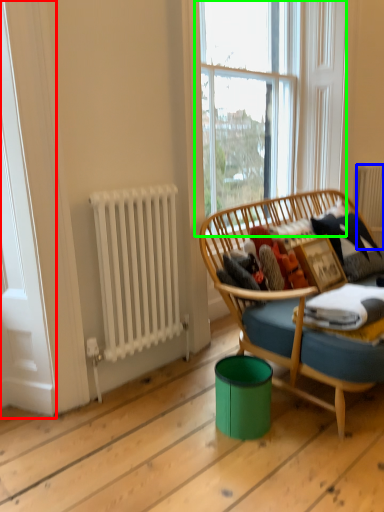
Question: Estimate the real-world distances between objects in this image. Which object is closer to screen door (highlighted by a red box), radiator (highlighted by a blue box) or window (highlighted by a green box)?

Choices:
 (A) radiator
 (B) window

Answer: (B)